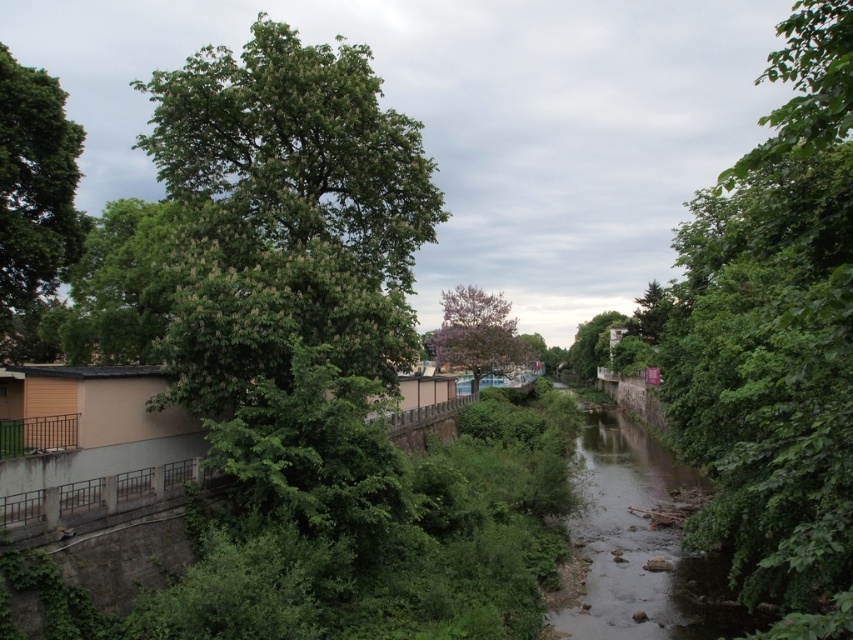
You are standing at the point closer to the viewer. Which point are you at? The point closer to the viewer is which one between point (730, 212) and point (456, 324)?

Point (730, 212) is closer to the viewer than point (456, 324), so you are at point (730, 212).